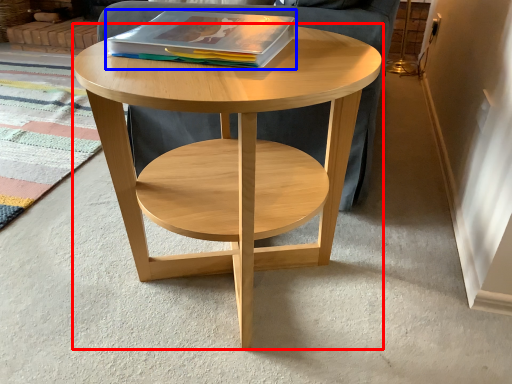
Question: Among these objects, which one is nearest to the camera, coffee table (highlighted by a red box) or magazine (highlighted by a blue box)?

Choices:
 (A) coffee table
 (B) magazine

Answer: (A)